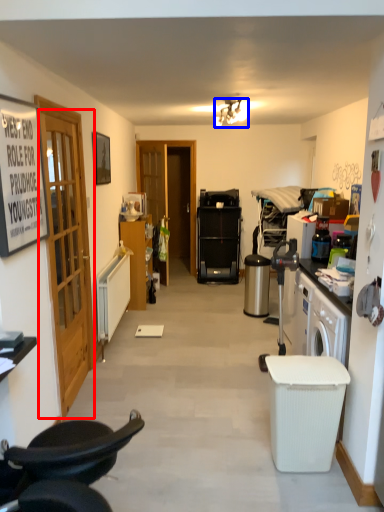
Question: Among these objects, which one is farthest to the camera, door (highlighted by a red box) or lamp (highlighted by a blue box)?

Choices:
 (A) door
 (B) lamp

Answer: (B)